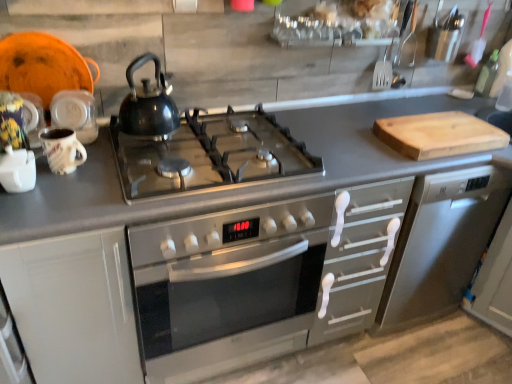
The width and height of the screenshot is (512, 384). I want to click on free spot above white matte cabinet at left (from a real-world perspective), so click(x=60, y=192).